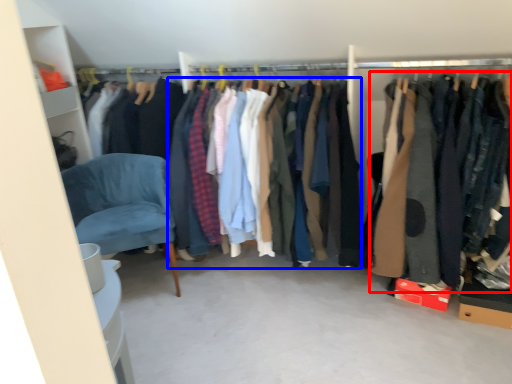
Question: Which point is closer to the camera, clothing (highlighted by a red box) or clothing (highlighted by a blue box)?

Choices:
 (A) clothing
 (B) clothing

Answer: (A)